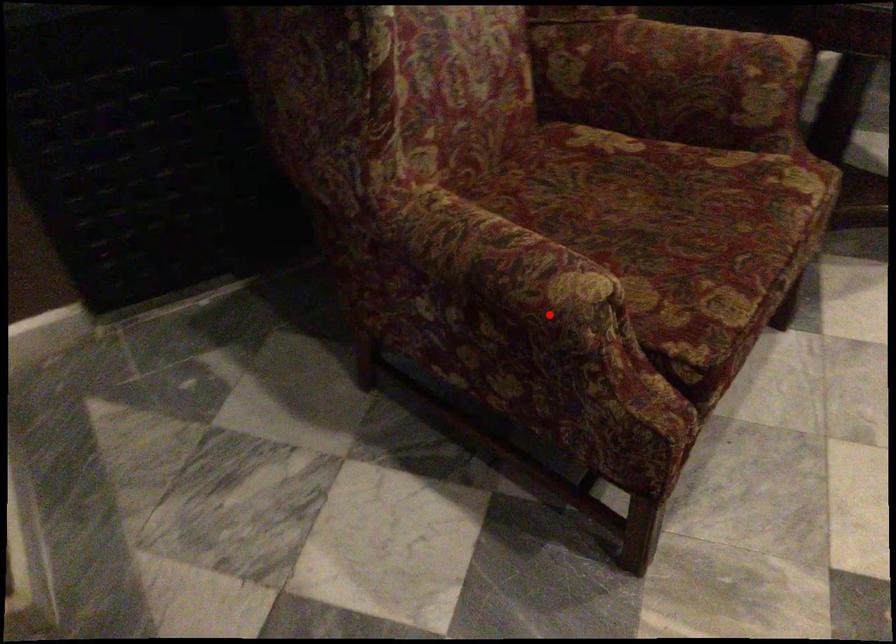
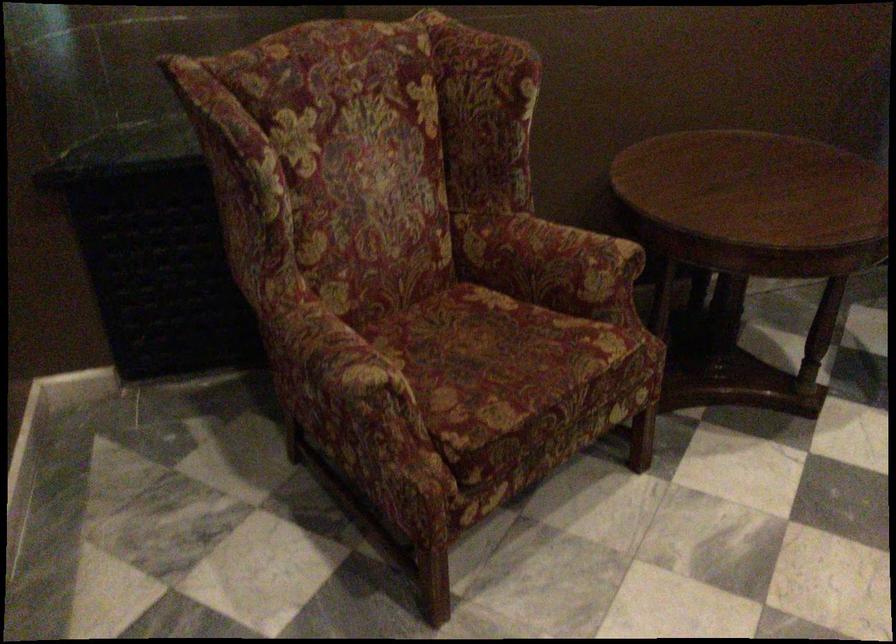
Question: I am providing you with two images of the same scene from different viewpoints. In image1, a red point is highlighted. Considering the same 3D point in image2, which of the following is correct?

Choices:
 (A) It is closer
 (B) It is farther

Answer: (B)